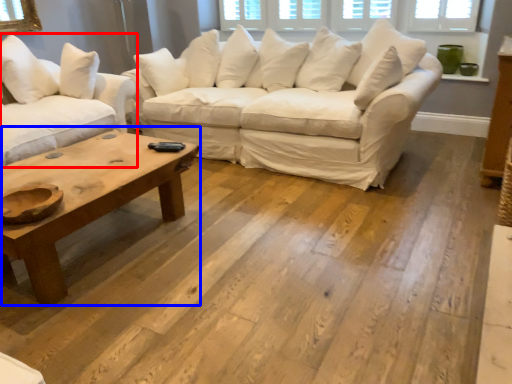
Question: Which of the following is the farthest to the observer, studio couch (highlighted by a red box) or coffee table (highlighted by a blue box)?

Choices:
 (A) studio couch
 (B) coffee table

Answer: (A)